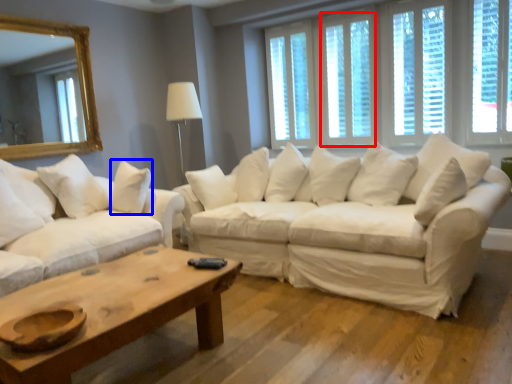
Question: Which object appears closest to the camera in this image, window (highlighted by a red box) or pillow (highlighted by a blue box)?

Choices:
 (A) window
 (B) pillow

Answer: (B)